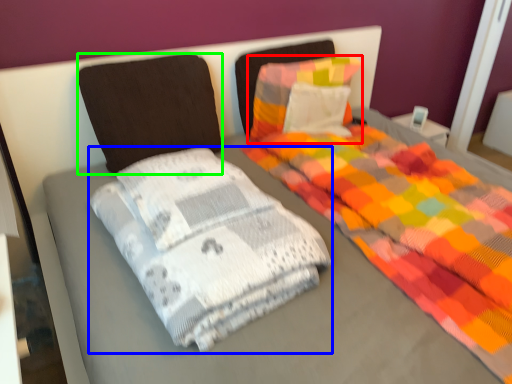
Question: Which object is positioned farthest from pillow (highlighted by a red box)? Select from material (highlighted by a blue box) and pillow (highlighted by a green box).

Choices:
 (A) material
 (B) pillow

Answer: (A)